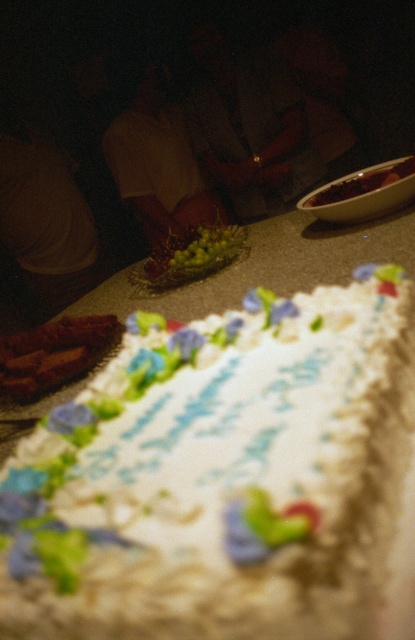
Consider the image. You are at a party and see the green shiny grapes at center and the smooth brown bowl at center on the table. Which object takes up more horizontal space?

The green shiny grapes at center might be wider than smooth brown bowl at center, so they could take up more horizontal space.

You are a photographer at the event and want to capture both the white frosted cake at center and the matte white shirt at center in a single frame. Since the cake is smaller, where should you position the camera relative to the objects to ensure both are clearly visible?

Since the white frosted cake at center is smaller than the matte white shirt at center, you should position the camera closer to the white frosted cake at center to balance their sizes in the frame.

You are at a party and want to grab a snack. You see the green shiny grapes at center and the smooth brown bowl at center. Which one is taller?

The green shiny grapes at center are taller than the smooth brown bowl at center.